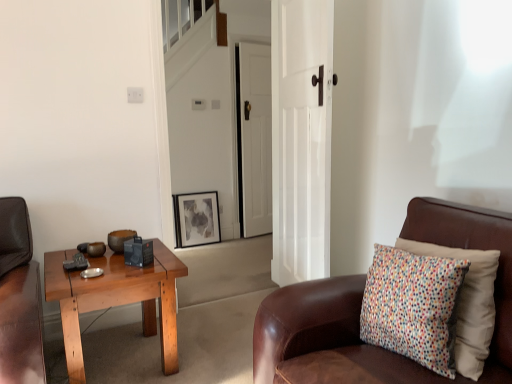
Image resolution: width=512 pixels, height=384 pixels. What are the coordinates of `vacant space underneath white wooden door at center, which appears as the first door when viewed from the back (from a real-world perspective)` in the screenshot? It's located at click(257, 240).